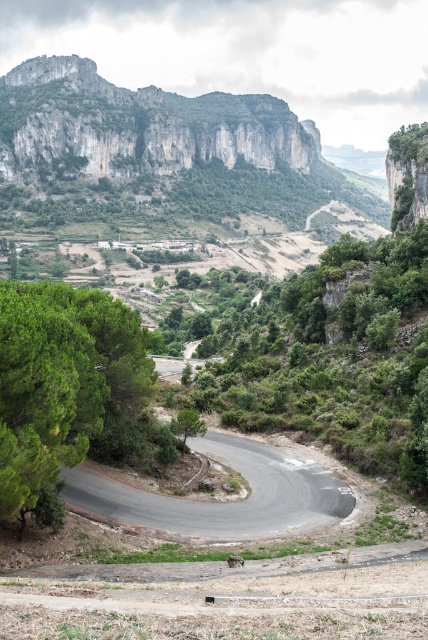
Question: From the image, what is the correct spatial relationship of green leafy tree at lower left in relation to green leafy tree at center?

Choices:
 (A) left
 (B) right

Answer: (A)

Question: Where is rugged stone mountain at upper left located in relation to green leafy tree at lower left in the image?

Choices:
 (A) right
 (B) left

Answer: (B)

Question: Based on their relative distances, which object is nearer to the green leafy tree at lower left?

Choices:
 (A) rugged stone mountain at upper left
 (B) green leafy tree at center

Answer: (B)

Question: Which is nearer to the rugged stone mountain at upper left?

Choices:
 (A) green leafy tree at center
 (B) green leafy tree at lower left

Answer: (B)

Question: Does rugged stone mountain at upper left come in front of green leafy tree at center?

Choices:
 (A) no
 (B) yes

Answer: (A)

Question: Which object is positioned closest to the green leafy tree at lower left?

Choices:
 (A) green leafy tree at center
 (B) rugged stone mountain at upper left

Answer: (A)